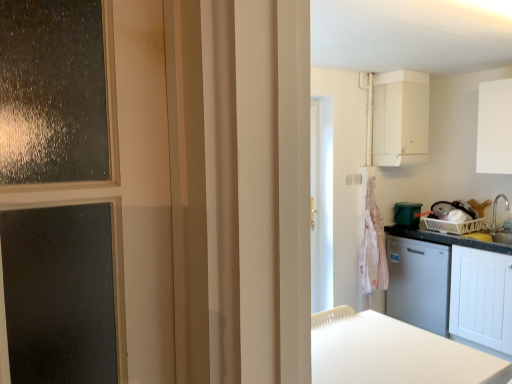
Measure the distance between white matte cabinet at lower right, positioned as the 2th cabinetry in bottom-to-top order, and camera.

white matte cabinet at lower right, positioned as the 2th cabinetry in bottom-to-top order, and camera are 3.03 meters apart.

What do you see at coordinates (481, 297) in the screenshot?
I see `white matte cabinet at right, which is the 3th cabinetry in top-to-bottom order` at bounding box center [481, 297].

This screenshot has height=384, width=512. Describe the element at coordinates (400, 118) in the screenshot. I see `white matte cabinet at upper right, acting as the 3th cabinetry starting from the bottom` at that location.

What is the approximate width of white matte cabinet at upper right, acting as the 3th cabinetry starting from the bottom?

12.23 inches.

What is the approximate width of green plastic bucket at right?

green plastic bucket at right is 17.84 inches wide.

Measure the distance between pink striped fabric at right and camera.

pink striped fabric at right and camera are 3.70 meters apart from each other.

This screenshot has height=384, width=512. Find the location of `white matte cabinet at lower right, the second cabinetry positioned from the top`. white matte cabinet at lower right, the second cabinetry positioned from the top is located at coordinates (451, 287).

Is white matte table at lower center at the right side of satin silver faucet at right?

In fact, white matte table at lower center is to the left of satin silver faucet at right.

Considering the sizes of objects white matte table at lower center and satin silver faucet at right in the image provided, who is bigger, white matte table at lower center or satin silver faucet at right?

With larger size is white matte table at lower center.

Is white matte table at lower center oriented away from satin silver faucet at right?

That's not correct — white matte table at lower center is not looking away from satin silver faucet at right.

Where is `laundry that is above the white matte table at lower center (from a real-world perspective)`? This screenshot has height=384, width=512. laundry that is above the white matte table at lower center (from a real-world perspective) is located at coordinates (373, 247).

Considering the sizes of objects white matte table at lower center and pink striped fabric at right in the image provided, who is taller, white matte table at lower center or pink striped fabric at right?

Standing taller between the two is pink striped fabric at right.

From a real-world perspective, is white matte table at lower center positioned above or below pink striped fabric at right?

Clearly, from a real-world perspective, white matte table at lower center is below pink striped fabric at right.

Which of these two, white matte table at lower center or pink striped fabric at right, is wider?

With larger width is white matte table at lower center.

Is white matte table at lower center far away from white matte cabinet at lower right, the second cabinetry positioned from the top?

Yes, white matte table at lower center is far from white matte cabinet at lower right, the second cabinetry positioned from the top.

From the image's perspective, which one is positioned higher, white matte table at lower center or white matte cabinet at lower right, positioned as the 2th cabinetry in bottom-to-top order?

white matte cabinet at lower right, positioned as the 2th cabinetry in bottom-to-top order, appears higher in the image.

Consider the image. Considering the sizes of objects white matte table at lower center and white matte cabinet at lower right, positioned as the 2th cabinetry in bottom-to-top order, in the image provided, who is shorter, white matte table at lower center or white matte cabinet at lower right, positioned as the 2th cabinetry in bottom-to-top order,?

With less height is white matte table at lower center.

Considering the relative positions of white matte table at lower center and white matte cabinet at lower right, the second cabinetry positioned from the top, in the image provided, is white matte table at lower center to the right of white matte cabinet at lower right, the second cabinetry positioned from the top, from the viewer's perspective?

No, white matte table at lower center is not to the right of white matte cabinet at lower right, the second cabinetry positioned from the top.

Looking at this image, from the image's perspective, which one is positioned higher, white matte cabinet at upper right, acting as the 3th cabinetry starting from the bottom, or white matte table at lower center?

white matte cabinet at upper right, acting as the 3th cabinetry starting from the bottom, appears higher in the image.

Between white matte cabinet at upper right, acting as the 3th cabinetry starting from the bottom, and white matte table at lower center, which one has larger width?

With larger width is white matte table at lower center.

How distant is white matte cabinet at upper right, which is the 1th cabinetry in top-to-bottom order, from white matte table at lower center?

white matte cabinet at upper right, which is the 1th cabinetry in top-to-bottom order, and white matte table at lower center are 6.62 feet apart from each other.

Relative to white matte table at lower center, is white matte cabinet at lower right, positioned as the 2th cabinetry in bottom-to-top order, in front or behind?

In the image, white matte cabinet at lower right, positioned as the 2th cabinetry in bottom-to-top order, appears behind white matte table at lower center.

Does point (445, 248) come in front of point (369, 357)?

No, it is not.

From the image's perspective, is white matte cabinet at lower right, the second cabinetry positioned from the top, located above white matte table at lower center?

Yes, from the image's perspective, white matte cabinet at lower right, the second cabinetry positioned from the top, is above white matte table at lower center.

Identify the location of sink lying on the right of pink striped fabric at right. This screenshot has height=384, width=512. (497, 225).

Is pink striped fabric at right aimed at satin silver faucet at right?

No, pink striped fabric at right is not aimed at satin silver faucet at right.

Could satin silver faucet at right be considered to be inside pink striped fabric at right?

No, pink striped fabric at right does not contain satin silver faucet at right.

Are pink striped fabric at right and satin silver faucet at right making contact?

No.

From a real-world perspective, is white matte cabinet at upper right, which is the 1th cabinetry in top-to-bottom order, located beneath green plastic bucket at right?

No, from a real-world perspective, white matte cabinet at upper right, which is the 1th cabinetry in top-to-bottom order, is not beneath green plastic bucket at right.

Is white matte cabinet at upper right, which is the 1th cabinetry in top-to-bottom order, with green plastic bucket at right?

No.

From the image's perspective, which is above, white matte cabinet at upper right, which is the 1th cabinetry in top-to-bottom order, or green plastic bucket at right?

From the image's view, white matte cabinet at upper right, which is the 1th cabinetry in top-to-bottom order, is above.

Where is `table below the satin silver faucet at right (from the image's perspective)`? Image resolution: width=512 pixels, height=384 pixels. table below the satin silver faucet at right (from the image's perspective) is located at coordinates (393, 352).

Locate an element on the screen. The width and height of the screenshot is (512, 384). laundry that is above the white matte table at lower center (from the image's perspective) is located at coordinates (373, 247).

When comparing their distances from pink striped fabric at right, does green plastic bucket at right or white matte table at lower center seem further?

white matte table at lower center lies further to pink striped fabric at right than the other object.

Based on their spatial positions, is green plastic bucket at right or white matte cabinet at lower right, the second cabinetry positioned from the top, further from white matte cabinet at upper right, acting as the 3th cabinetry starting from the bottom?

Based on the image, white matte cabinet at lower right, the second cabinetry positioned from the top, appears to be further to white matte cabinet at upper right, acting as the 3th cabinetry starting from the bottom.

Based on their spatial positions, is pink striped fabric at right or white matte cabinet at lower right, the second cabinetry positioned from the top, further from satin silver faucet at right?

Among the two, pink striped fabric at right is located further to satin silver faucet at right.

When comparing their distances from white matte cabinet at right, which is the 3th cabinetry in top-to-bottom order, does white matte table at lower center or white matte cabinet at lower right, positioned as the 2th cabinetry in bottom-to-top order, seem closer?

white matte cabinet at lower right, positioned as the 2th cabinetry in bottom-to-top order.

Estimate the real-world distances between objects in this image. Which object is closer to white matte cabinet at lower right, positioned as the 2th cabinetry in bottom-to-top order, green plastic bucket at right or pink striped fabric at right?

The object closer to white matte cabinet at lower right, positioned as the 2th cabinetry in bottom-to-top order, is pink striped fabric at right.

Based on their spatial positions, is white matte cabinet at right, the 1th cabinetry ordered from the bottom, or white matte table at lower center further from satin silver faucet at right?

Among the two, white matte table at lower center is located further to satin silver faucet at right.

Considering their positions, is white matte cabinet at upper right, which is the 1th cabinetry in top-to-bottom order, positioned further to satin silver faucet at right than white matte cabinet at lower right, positioned as the 2th cabinetry in bottom-to-top order?

Among the two, white matte cabinet at upper right, which is the 1th cabinetry in top-to-bottom order, is located further to satin silver faucet at right.

Which object lies further to the anchor point green plastic bucket at right, white matte cabinet at upper right, acting as the 3th cabinetry starting from the bottom, or white matte cabinet at lower right, the second cabinetry positioned from the top?

→ white matte cabinet at upper right, acting as the 3th cabinetry starting from the bottom.

You are a GUI agent. You are given a task and a screenshot of the screen. Output one action in this format:
    pyautogui.click(x=<x>, y=<y>)
    Task: Click on the sink between white matte table at lower center and white matte cabinet at lower right, the second cabinetry positioned from the top, from front to back
    This screenshot has width=512, height=384.
    Given the screenshot: What is the action you would take?
    pyautogui.click(x=497, y=225)

You are a GUI agent. You are given a task and a screenshot of the screen. Output one action in this format:
    pyautogui.click(x=<x>, y=<y>)
    Task: Click on the sink located between white matte cabinet at right, the 1th cabinetry ordered from the bottom, and green plastic bucket at right in the depth direction
    The width and height of the screenshot is (512, 384).
    Given the screenshot: What is the action you would take?
    pyautogui.click(x=497, y=225)

I want to click on sink between white matte cabinet at upper right, which is the 1th cabinetry in top-to-bottom order, and green plastic bucket at right in the up-down direction, so click(x=497, y=225).

Identify the location of sink between white matte cabinet at upper right, acting as the 3th cabinetry starting from the bottom, and pink striped fabric at right vertically. (497, 225).